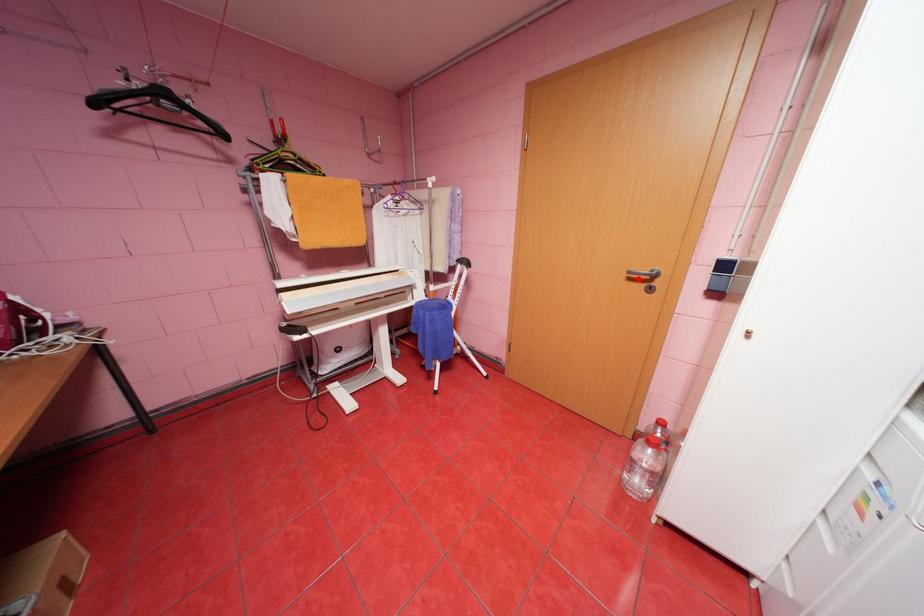
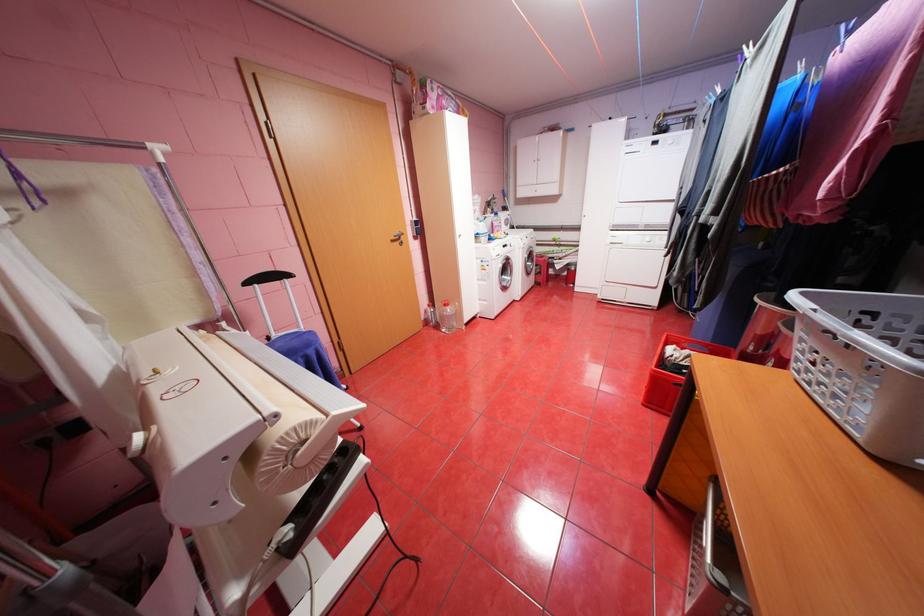
The point at the highlighted location is marked in the first image. Where is the corresponding point in the second image?

(400, 241)